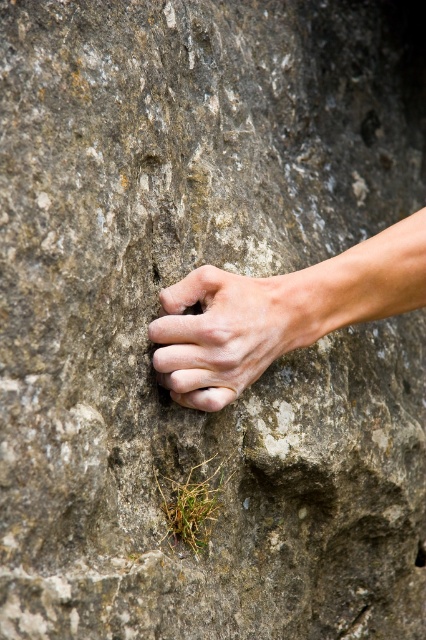
You are a rock climber trying to place your hands on the rock face. You have two options for hand placement based on the image. Which hand placement option has a wider grip? Please choose between the smooth skin hand at center and the white matte hand at center.

The smooth skin hand at center has a larger width than the white matte hand at center, so the smooth skin hand at center provides a wider grip.

You are a rock climber assessing your grip on the rock. You notice two parts of your hand touching the rock surface. One is the smooth skin hand at center and the other is the white matte hand at center. Which part of your hand has a higher position on the rock?

The smooth skin hand at center has a greater height compared to the white matte hand at center, so the smooth skin hand at center is higher on the rock.

You are a photographer trying to capture the exact position of the smooth skin hand at center in the image. According to the coordinates provided, where should you focus your camera lens to ensure the hand is perfectly centered in the frame?

The smooth skin hand at center is located at the 2D coordinates point (279, 312), so you should focus your camera lens at that point to center the hand in the frame.